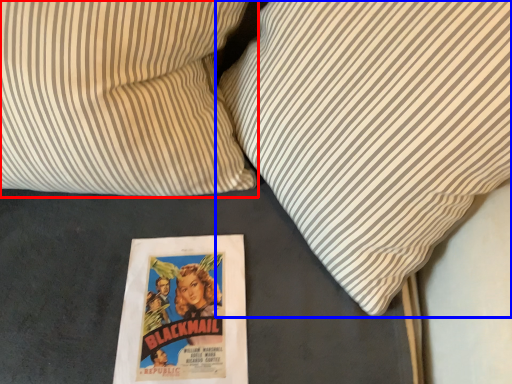
Question: Among these objects, which one is farthest to the camera, pillow (highlighted by a red box) or pillow (highlighted by a blue box)?

Choices:
 (A) pillow
 (B) pillow

Answer: (A)